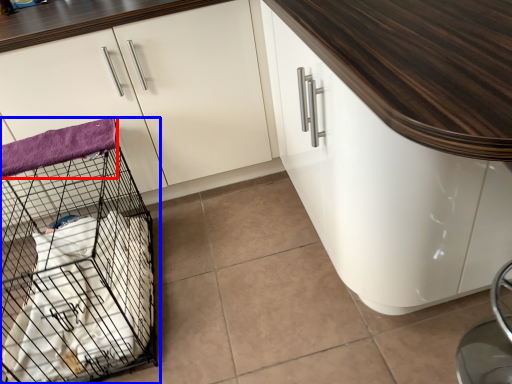
Question: Which object appears farthest to the camera in this image, blanket (highlighted by a red box) or bird cage (highlighted by a blue box)?

Choices:
 (A) blanket
 (B) bird cage

Answer: (A)